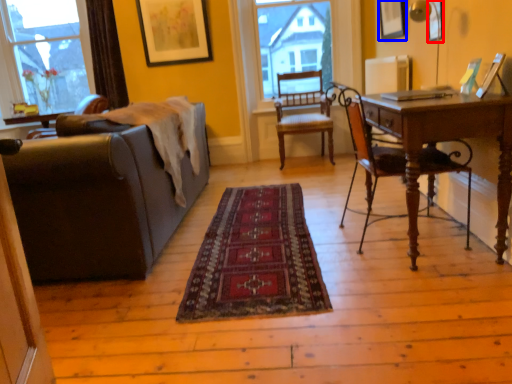
Question: Among these objects, which one is farthest to the camera, picture frame (highlighted by a red box) or picture frame (highlighted by a blue box)?

Choices:
 (A) picture frame
 (B) picture frame

Answer: (B)